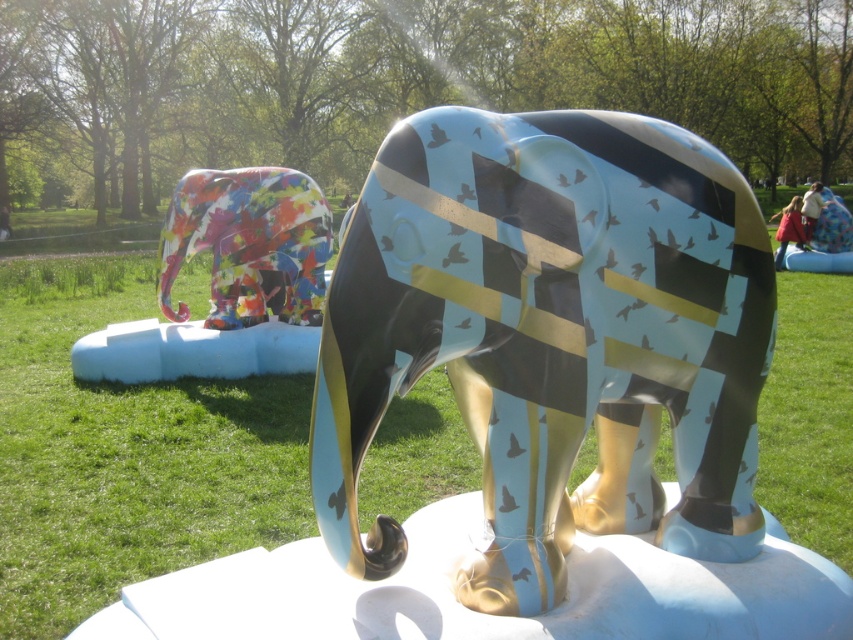
You are a gardener who wants to plant a new flower bed between the green grass at center and the multicolored glossy elephant at left. According to the scene description, where exactly should you place the flowers?

The green grass at center is located below the multicolored glossy elephant at left, so the flower bed should be placed between the green grass at center and the multicolored glossy elephant at left, ensuring it is positioned below the elephant and above the grass area.